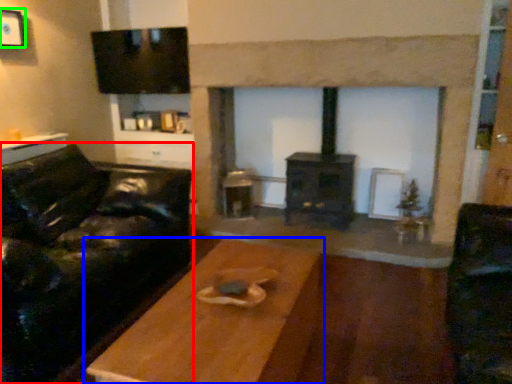
Question: Which object is positioned farthest from studio couch (highlighted by a red box)? Select from table (highlighted by a blue box) and picture frame (highlighted by a green box).

Choices:
 (A) table
 (B) picture frame

Answer: (B)